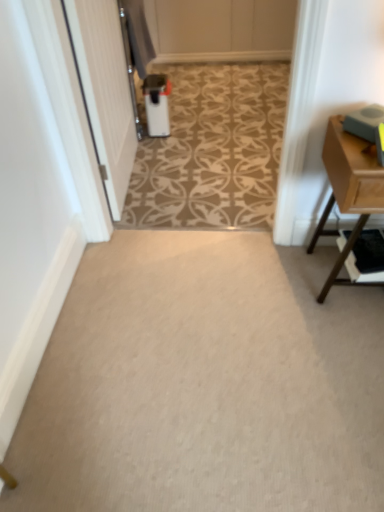
This screenshot has height=512, width=384. Describe the element at coordinates (367, 257) in the screenshot. I see `wooden shelf at right` at that location.

Locate an element on the screen. The height and width of the screenshot is (512, 384). light brown wood table at right is located at coordinates (348, 189).

Identify the location of carpet at center. (205, 382).

You are a GUI agent. You are given a task and a screenshot of the screen. Output one action in this format:
    pyautogui.click(x=<x>, y=<y>)
    Task: Click on the white glossy trash can at center
    Image resolution: width=384 pixels, height=512 pixels.
    Given the screenshot: What is the action you would take?
    pyautogui.click(x=212, y=150)

The width and height of the screenshot is (384, 512). I want to click on wooden shelf at right, so click(x=367, y=257).

Would you say wooden shelf at right is outside light brown wood table at right?

Actually, wooden shelf at right is within light brown wood table at right.

Is wooden shelf at right aimed at light brown wood table at right?

Yes, wooden shelf at right is turned towards light brown wood table at right.

Is wooden shelf at right closer to the viewer compared to light brown wood table at right?

No, it is not.

Is wooden shelf at right to the right of light brown wood table at right from the viewer's perspective?

Yes.

Considering the positions of objects white glossy trash can at center and carpet at center in the image provided, who is more to the left, white glossy trash can at center or carpet at center?

white glossy trash can at center is more to the left.

Can you confirm if white glossy trash can at center is taller than carpet at center?

Indeed, white glossy trash can at center has a greater height compared to carpet at center.

Can we say white glossy trash can at center lies outside carpet at center?

Actually, white glossy trash can at center is within carpet at center.

Is white glossy trash can at center closer to camera compared to carpet at center?

No, white glossy trash can at center is behind carpet at center.

Is light brown wood table at right far from carpet at center?

light brown wood table at right is near carpet at center, not far away.

Is light brown wood table at right at the left side of carpet at center?

→ In fact, light brown wood table at right is to the right of carpet at center.

Which object is thinner, light brown wood table at right or carpet at center?

light brown wood table at right.

Is light brown wood table at right beside wooden shelf at right?

They are not placed beside each other.

Locate an element on the screen. The height and width of the screenshot is (512, 384). table above the wooden shelf at right (from the image's perspective) is located at coordinates (348, 189).

Considering the sizes of light brown wood table at right and wooden shelf at right in the image, is light brown wood table at right wider or thinner than wooden shelf at right?

In the image, light brown wood table at right appears to be wider than wooden shelf at right.

Looking at the image, does light brown wood table at right seem bigger or smaller compared to wooden shelf at right?

light brown wood table at right is bigger than wooden shelf at right.

Considering the relative positions of carpet at center and wooden shelf at right in the image provided, is carpet at center behind wooden shelf at right?

No, the depth of carpet at center is less than that of wooden shelf at right.

Find the location of `shelf that appears on the right of carpet at center`. shelf that appears on the right of carpet at center is located at coordinates (367, 257).

Is carpet at center next to wooden shelf at right and touching it?

No, carpet at center is not with wooden shelf at right.

From the image's perspective, is carpet at center on wooden shelf at right?

Correct, carpet at center appears higher than wooden shelf at right in the image.

Could you tell me if light brown wood table at right is turned towards white glossy trash can at center?

No.

Considering the relative sizes of light brown wood table at right and white glossy trash can at center in the image provided, is light brown wood table at right wider than white glossy trash can at center?

Incorrect, the width of light brown wood table at right does not surpass that of white glossy trash can at center.

Can you confirm if light brown wood table at right is bigger than white glossy trash can at center?

No, light brown wood table at right is not bigger than white glossy trash can at center.

From the image's perspective, is light brown wood table at right over white glossy trash can at center?

No, from the image's perspective, light brown wood table at right is not on top of white glossy trash can at center.

Can you confirm if white glossy trash can at center is smaller than light brown wood table at right?

Actually, white glossy trash can at center might be larger than light brown wood table at right.

Locate an element on the screen. table above the white glossy trash can at center (from a real-world perspective) is located at coordinates (348, 189).

From the image's perspective, which is below, white glossy trash can at center or light brown wood table at right?

light brown wood table at right appears lower in the image.

From the picture: Which is more to the left, white glossy trash can at center or light brown wood table at right?

From the viewer's perspective, white glossy trash can at center appears more on the left side.

Identify the location of table above the wooden shelf at right (from a real-world perspective). The image size is (384, 512). (348, 189).

At what (x,y) coordinates should I click in order to perform the action: click on pattern behind the carpet at center. Please return your answer as a coordinate pair (x, y). Image resolution: width=384 pixels, height=512 pixels. Looking at the image, I should click on (212, 150).

Based on the photo, from the image, which object appears to be farther from light brown wood table at right, white glossy trash can at center or carpet at center?

white glossy trash can at center is further to light brown wood table at right.

When comparing their distances from carpet at center, does wooden shelf at right or light brown wood table at right seem further?

The object further to carpet at center is light brown wood table at right.

From the image, which object appears to be nearer to light brown wood table at right, white glossy trash can at center or wooden shelf at right?

wooden shelf at right.

Looking at the image, which one is located further to wooden shelf at right, white glossy trash can at center or light brown wood table at right?

The object further to wooden shelf at right is white glossy trash can at center.

Based on their spatial positions, is carpet at center or light brown wood table at right closer to wooden shelf at right?

Among the two, light brown wood table at right is located nearer to wooden shelf at right.

Looking at the image, which one is located further to light brown wood table at right, wooden shelf at right or white glossy trash can at center?

Based on the image, white glossy trash can at center appears to be further to light brown wood table at right.

From the image, which object appears to be nearer to carpet at center, wooden shelf at right or white glossy trash can at center?

Based on the image, wooden shelf at right appears to be nearer to carpet at center.

When comparing their distances from light brown wood table at right, does carpet at center or wooden shelf at right seem closer?

Among the two, wooden shelf at right is located nearer to light brown wood table at right.

At what (x,y) coordinates should I click in order to perform the action: click on table positioned between carpet at center and white glossy trash can at center from near to far. Please return your answer as a coordinate pair (x, y). Looking at the image, I should click on (348, 189).

Locate an element on the screen. This screenshot has width=384, height=512. table between white glossy trash can at center and wooden shelf at right in the up-down direction is located at coordinates (348, 189).

This screenshot has height=512, width=384. I want to click on table between carpet at center and wooden shelf at right, so click(348, 189).

I want to click on plain that lies between white glossy trash can at center and wooden shelf at right from top to bottom, so click(x=205, y=382).